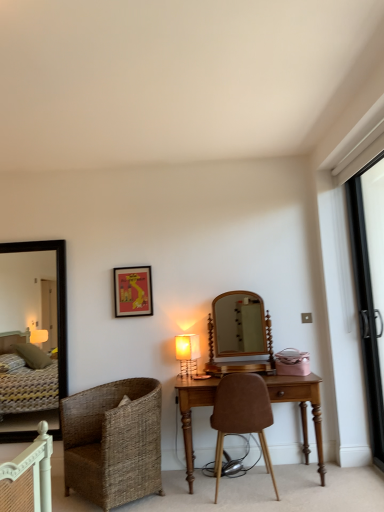
Where is `vacant area that is situated to the right of brown leather chair at center, arranged as the second chair when viewed from the left`? The width and height of the screenshot is (384, 512). vacant area that is situated to the right of brown leather chair at center, arranged as the second chair when viewed from the left is located at coordinates (323, 495).